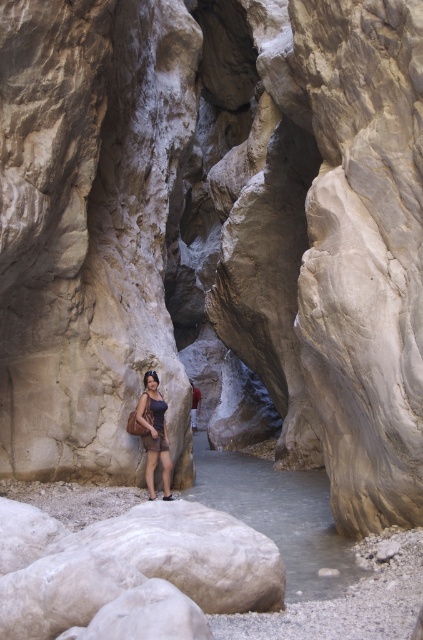
Is clear water at center wider than matte purple dress at center?

Yes, clear water at center is wider than matte purple dress at center.

Is point (293, 538) positioned before point (151, 397)?

Yes, it is in front of point (151, 397).

You are a GUI agent. You are given a task and a screenshot of the screen. Output one action in this format:
    pyautogui.click(x=<x>, y=<y>)
    Task: Click on the clear water at center
    The width and height of the screenshot is (423, 640).
    Given the screenshot: What is the action you would take?
    pyautogui.click(x=277, y=515)

Does point (241, 500) come in front of point (195, 417)?

That is True.

Can you confirm if clear water at center is wider than red fabric shirt at center?

Yes, clear water at center is wider than red fabric shirt at center.

This screenshot has height=640, width=423. What do you see at coordinates (277, 515) in the screenshot?
I see `clear water at center` at bounding box center [277, 515].

Where is `clear water at center`? The height and width of the screenshot is (640, 423). clear water at center is located at coordinates (277, 515).

Can you confirm if matte purple dress at center is wider than red fabric shirt at center?

Yes.

Is matte purple dress at center thinner than red fabric shirt at center?

No, matte purple dress at center is not thinner than red fabric shirt at center.

Measure the distance between point (x=156, y=401) and camera.

Point (x=156, y=401) is 28.48 feet away from camera.

Locate an element on the screen. matte purple dress at center is located at coordinates [x=153, y=433].